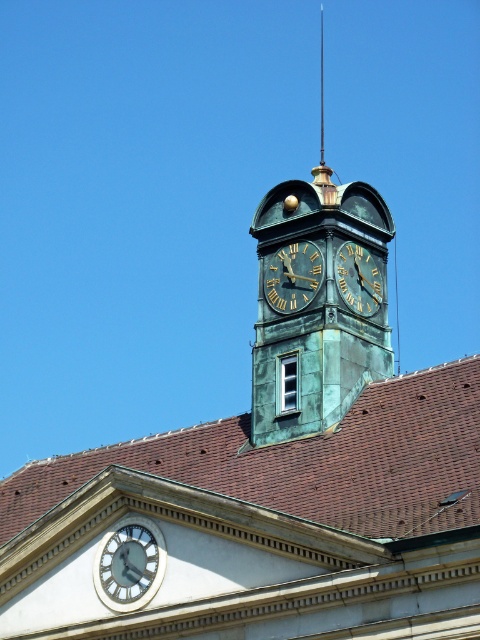
You are standing in front of the building with the clock tower and want to take a photo. You notice two points marked on the image at coordinates point (x=140, y=573) and point (x=354, y=272). Which point should you focus on first if you want to ensure both points are in sharp focus?

You should focus on point (x=140, y=573) first because it is closer to the viewer, so focusing on the closer point will help ensure both points are in sharp focus.